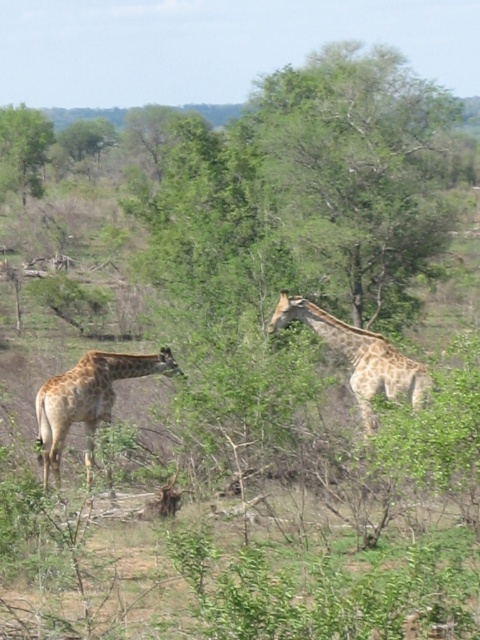
Does spotted fur giraffe at left have a lesser height compared to spotted fur giraffe at center?

Yes, spotted fur giraffe at left is shorter than spotted fur giraffe at center.

Does point (93, 364) come farther from viewer compared to point (412, 368)?

No, (93, 364) is in front of (412, 368).

Identify the location of spotted fur giraffe at left. This screenshot has height=640, width=480. (87, 401).

Based on the photo, who is taller, spotted fur giraffe at left or green leafy tree at upper left?

green leafy tree at upper left

Identify the location of spotted fur giraffe at left. (87, 401).

Is point (90, 413) closer to viewer compared to point (3, 144)?

Yes.

Locate an element on the screen. The width and height of the screenshot is (480, 640). spotted fur giraffe at left is located at coordinates (87, 401).

Based on the photo, which is more to the left, spotted fur giraffe at center or green leafy tree at upper left?

green leafy tree at upper left

Is spotted fur giraffe at center wider than green leafy tree at upper left?

No, spotted fur giraffe at center is not wider than green leafy tree at upper left.

What do you see at coordinates (359, 356) in the screenshot? I see `spotted fur giraffe at center` at bounding box center [359, 356].

Where is `spotted fur giraffe at center`? Image resolution: width=480 pixels, height=640 pixels. spotted fur giraffe at center is located at coordinates click(x=359, y=356).